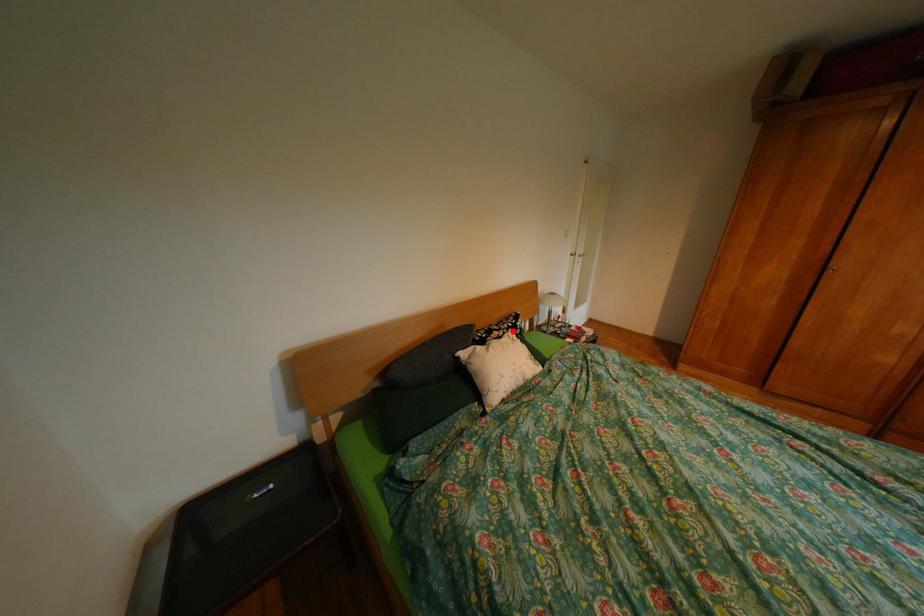
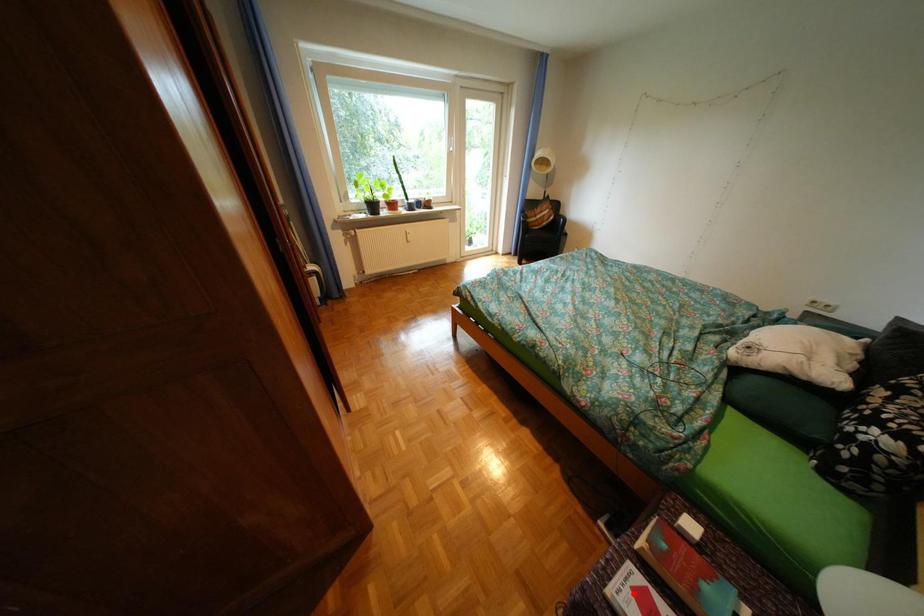
I am providing you with two images of the same scene from different viewpoints. A red point is marked on the first image and another point is marked on the second image. Do the highlighted points in image1 and image2 indicate the same real-world spot?

No